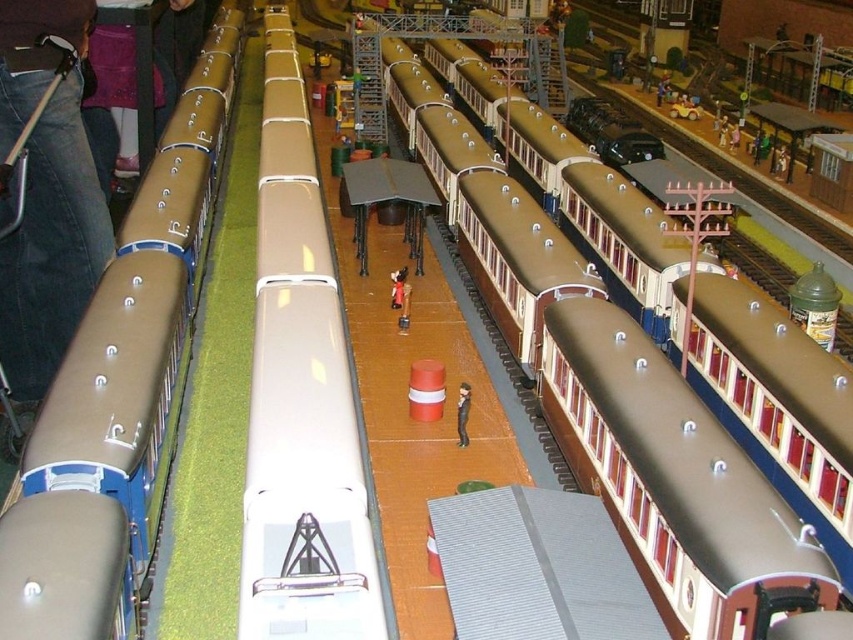
Question: Can you confirm if white glossy train car at center is bigger than smooth black figure at center?

Choices:
 (A) yes
 (B) no

Answer: (A)

Question: Estimate the real-world distances between objects in this image. Which object is closer to the matte brown train car at left?

Choices:
 (A) brown matte train at center
 (B) smooth black figure at center
 (C) white glossy train car at center

Answer: (C)

Question: Which is farther from the white glossy train car at center?

Choices:
 (A) brown matte train at center
 (B) smooth black figure at center

Answer: (A)

Question: Can you confirm if white glossy train car at center is smaller than smooth black figure at center?

Choices:
 (A) no
 (B) yes

Answer: (A)

Question: Which is farther from the matte brown train car at left?

Choices:
 (A) smooth black figure at center
 (B) brown matte train at center

Answer: (B)

Question: In this image, where is brown matte train at center located relative to smooth black figure at center?

Choices:
 (A) right
 (B) left

Answer: (A)